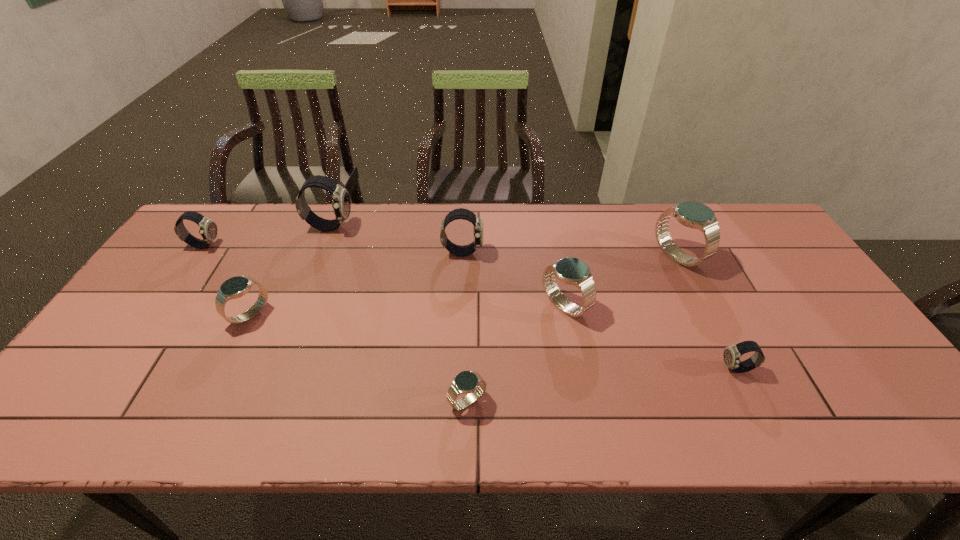
You are a GUI agent. You are given a task and a screenshot of the screen. Output one action in this format:
    pyautogui.click(x=<x>, y=<y>)
    Task: Click on the vacant area between the farthest dark watch and the nearest object
    The height and width of the screenshot is (540, 960).
    Given the screenshot: What is the action you would take?
    pyautogui.click(x=398, y=314)

This screenshot has width=960, height=540. I want to click on vacant space in between the third dark watch from right to left and the second nearest watch, so point(534,298).

Identify the location of object that is the seventh nearest to the third blue watch from right to left. (208, 229).

This screenshot has width=960, height=540. In order to click on the closest object relative to the third dark watch from left to right in this screenshot , I will do `click(572, 271)`.

Identify which watch is the fourth nearest to the rightmost blue watch. Please provide its 2D coordinates. Your answer should be formatted as a tuple, i.e. [(x, y)], where the tuple contains the x and y coordinates of a point satisfying the conditions above.

[(466, 382)]

Locate an element on the screen. The image size is (960, 540). the fourth closest watch relative to the smallest dark watch is located at coordinates (461, 213).

Locate which dark watch ranks third in proximity to the third watch from right to left. Please provide its 2D coordinates. Your answer should be formatted as a tuple, i.e. [(x, y)], where the tuple contains the x and y coordinates of a point satisfying the conditions above.

[(341, 205)]

Locate which dark watch ranks in proximity to the second smallest blue watch. Please provide its 2D coordinates. Your answer should be formatted as a tuple, i.e. [(x, y)], where the tuple contains the x and y coordinates of a point satisfying the conditions above.

[(208, 229)]

This screenshot has width=960, height=540. Find the location of `blue watch that is the nearest to the smallest dark watch`. blue watch that is the nearest to the smallest dark watch is located at coordinates (691, 214).

I want to click on blue watch that stands as the second closest to the rightmost blue watch, so click(x=466, y=382).